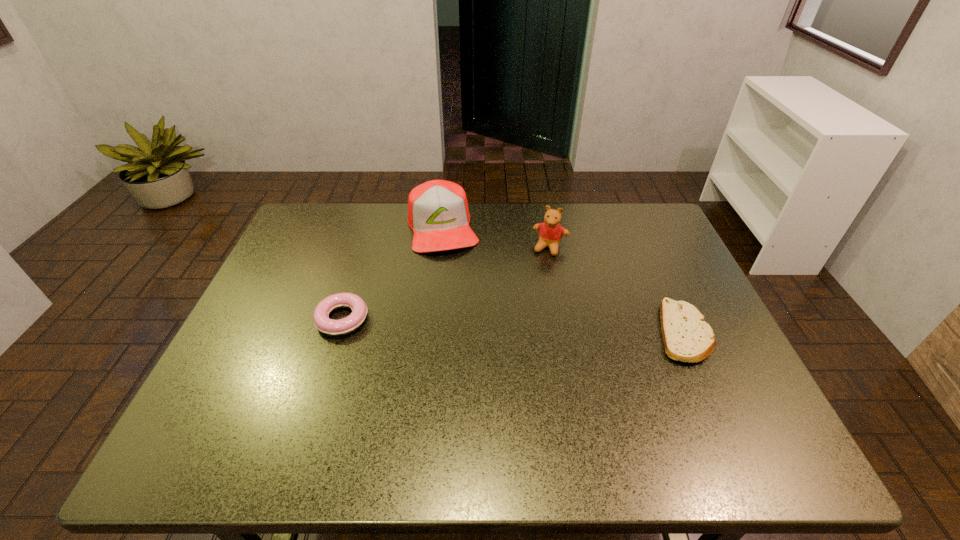
Locate an element on the screen. vacant spot on the desktop that is between the second shortest object and the pita bread and is positioned on the front-facing side of the baseball cap is located at coordinates (468, 324).

Locate an element on the screen. Image resolution: width=960 pixels, height=540 pixels. vacant space on the desktop that is between the leftmost object and the shortest object and is positioned on the front-facing side of the teddy bear is located at coordinates (521, 326).